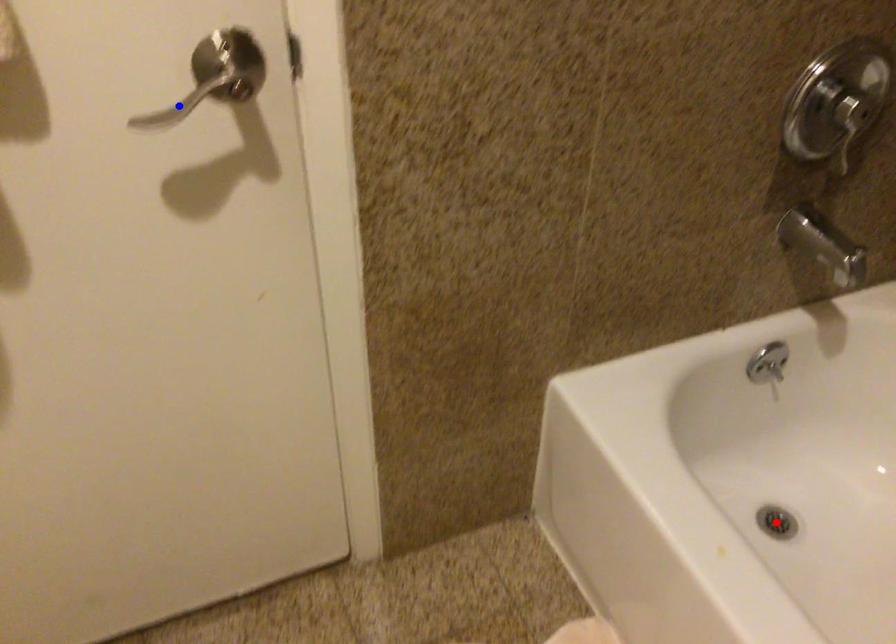
Question: Two points are marked on the image. Which point is closer to the camera?

Choices:
 (A) Blue point is closer.
 (B) Red point is closer.

Answer: (A)